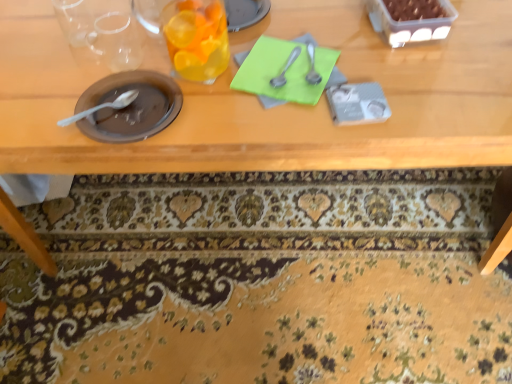
I want to click on free space to the left of matte brown plate at left, the fourth tableware viewed from the right, so click(46, 101).